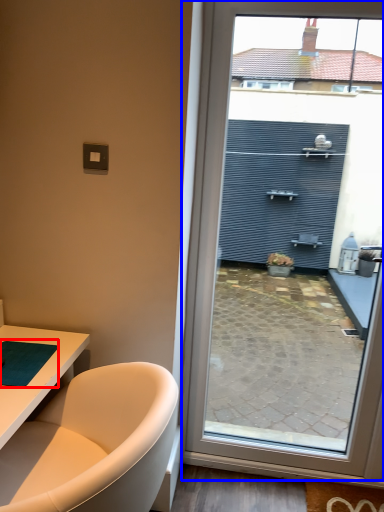
Question: Among these objects, which one is farthest to the camera, yoga mat (highlighted by a red box) or window (highlighted by a blue box)?

Choices:
 (A) yoga mat
 (B) window

Answer: (B)